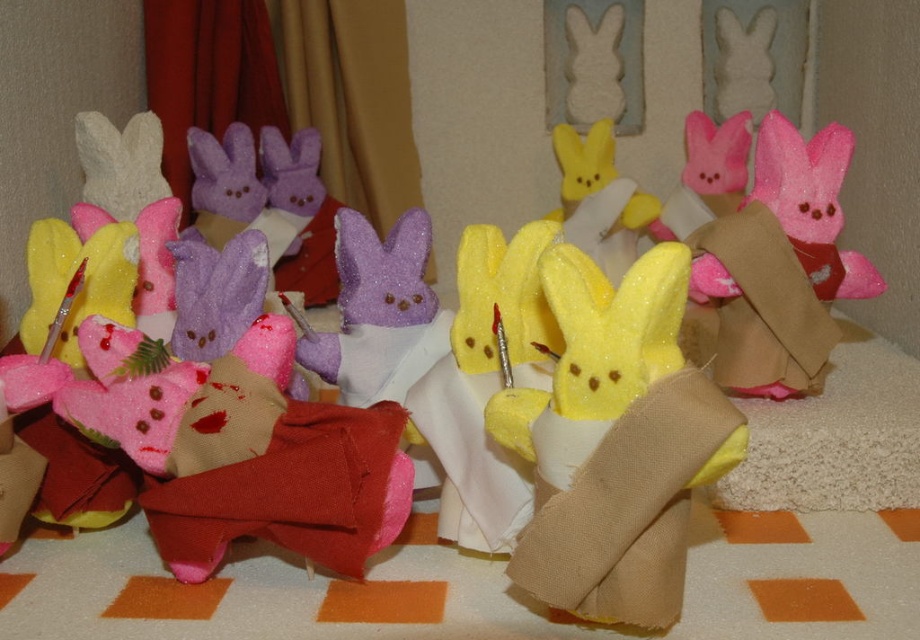
Does glittery yellow bunny at center have a greater height compared to pink felt bunny at center?

No, glittery yellow bunny at center is not taller than pink felt bunny at center.

Describe the element at coordinates (614, 442) in the screenshot. I see `glittery yellow bunny at center` at that location.

At what (x,y) coordinates should I click in order to perform the action: click on glittery yellow bunny at center. Please return your answer as a coordinate pair (x, y). Looking at the image, I should click on (614, 442).